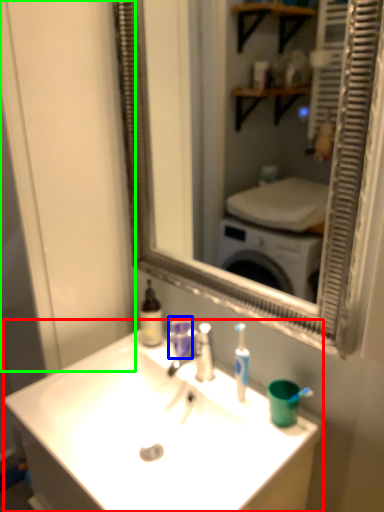
Question: Which is farther away from sink (highlighted by a red box)? mouthwash (highlighted by a blue box) or glass door (highlighted by a green box)?

Choices:
 (A) mouthwash
 (B) glass door

Answer: (B)